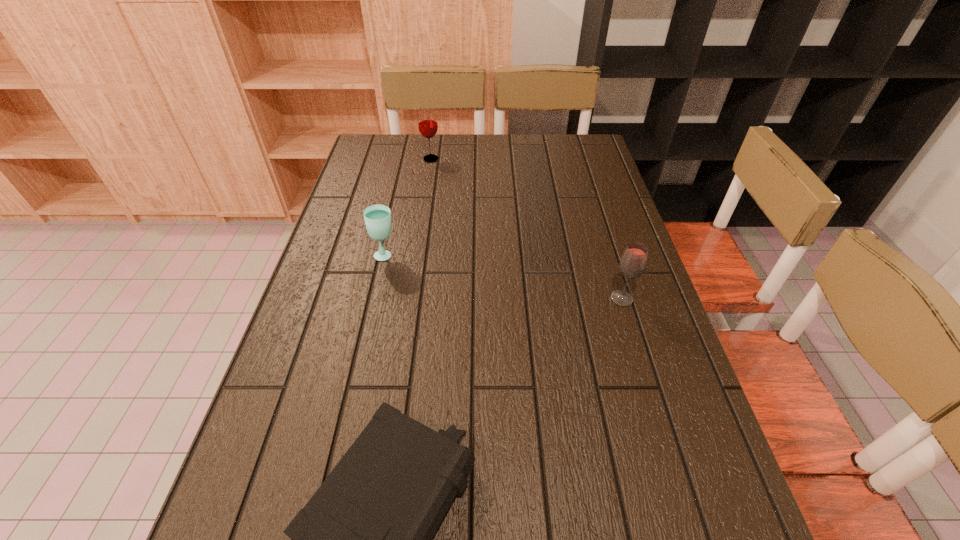
Find the location of a particular element. The height and width of the screenshot is (540, 960). vacant space that is in between the rightmost object and the leftmost glass is located at coordinates (503, 276).

You are a GUI agent. You are given a task and a screenshot of the screen. Output one action in this format:
    pyautogui.click(x=<x>, y=<y>)
    Task: Click on the vacant area between the farthest glass and the rightmost object
    The width and height of the screenshot is (960, 540).
    Given the screenshot: What is the action you would take?
    pyautogui.click(x=526, y=229)

This screenshot has width=960, height=540. Identify the location of object that can be found as the second closest to the Bible. (377, 217).

In order to click on the third closest object to the nearest object in this screenshot , I will do `click(427, 121)`.

This screenshot has width=960, height=540. In order to click on glass that is the nearest to the second nearest glass in this screenshot , I will do `click(427, 121)`.

This screenshot has height=540, width=960. I want to click on the closest glass relative to the rightmost glass, so click(377, 217).

In order to click on free spot that satisfies the following two spatial constraints: 1. on the front side of the leftmost glass; 2. on the left side of the rightmost object in this screenshot , I will do `click(375, 299)`.